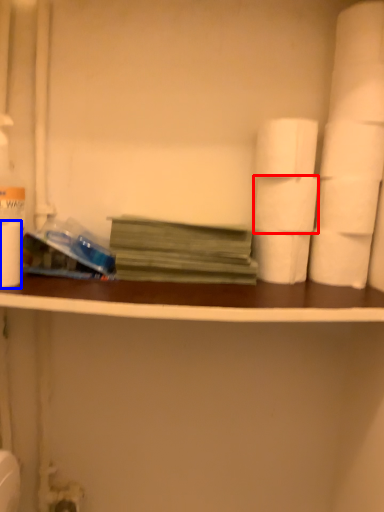
Question: Which object appears closest to the camera in this image, toilet paper (highlighted by a red box) or paper towel (highlighted by a blue box)?

Choices:
 (A) toilet paper
 (B) paper towel

Answer: (B)